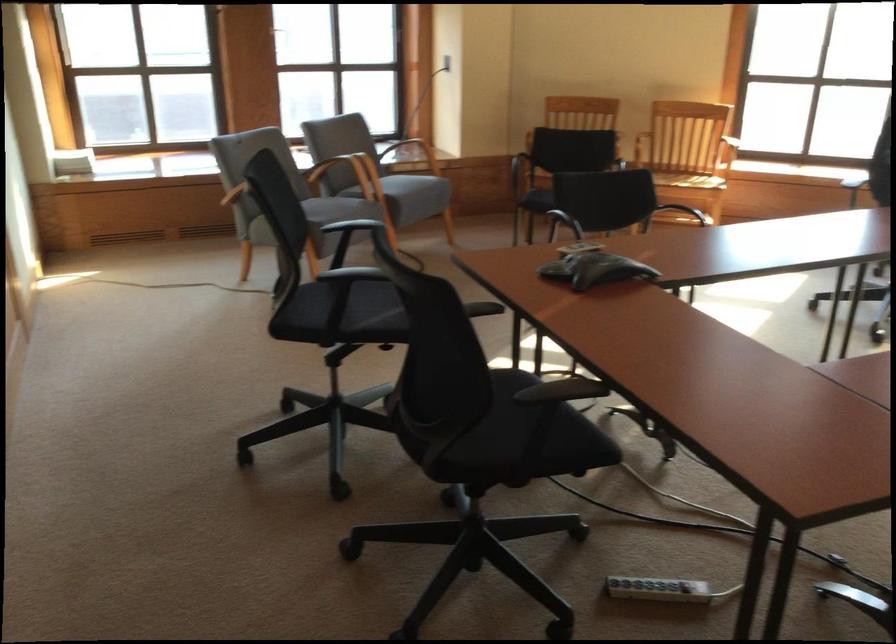
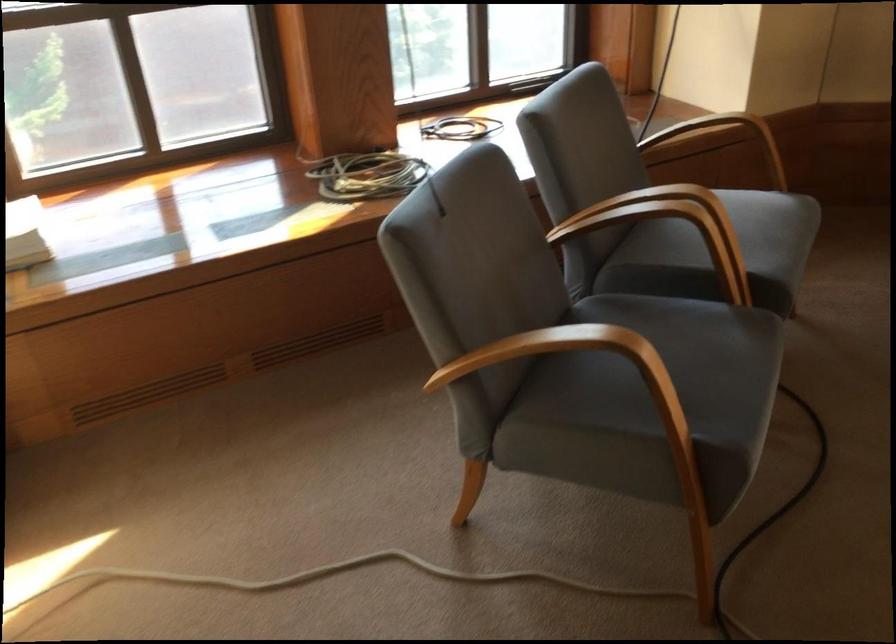
Question: I am providing you with two images of the same scene from different viewpoints. Please identify which objects are invisible in image2.

Choices:
 (A) grey chair sitting surface
 (B) red plastic caddy
 (C) wooden chair armrest
 (D) coiled electrical cord

Answer: (A)